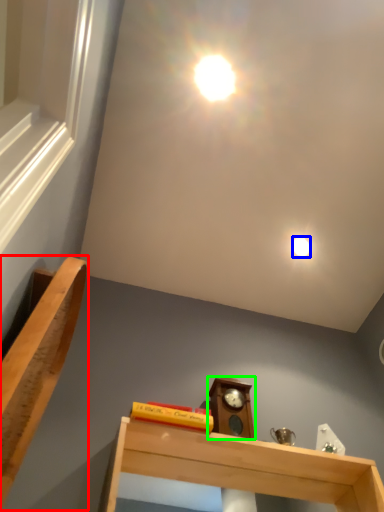
Question: Which object is the closest to the furniture (highlighted by a red box)? Choose among these: droplight (highlighted by a blue box) or alarm clock (highlighted by a green box).

Choices:
 (A) droplight
 (B) alarm clock

Answer: (B)